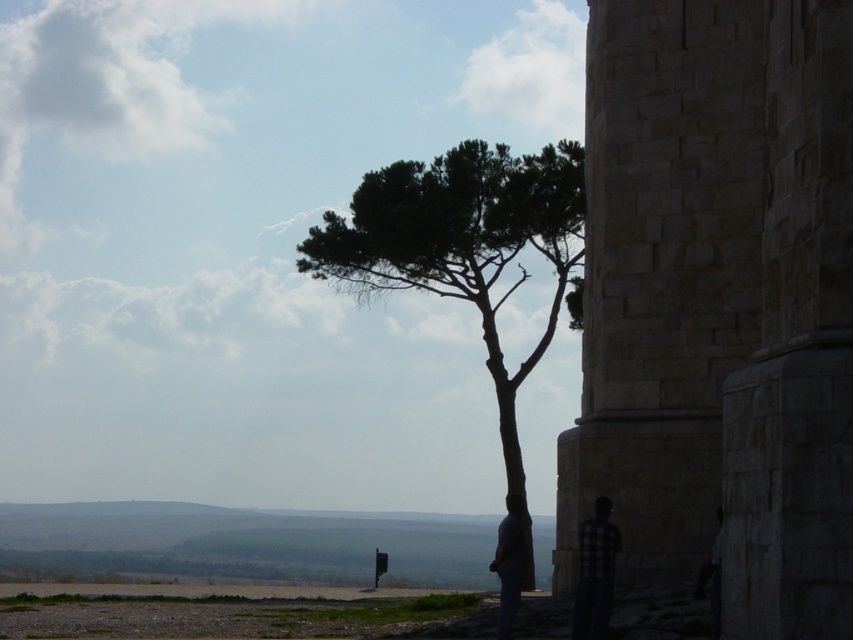
Question: In this image, where is green leafy tree at center located relative to dark blue jeans at lower center?

Choices:
 (A) above
 (B) below

Answer: (A)

Question: Which object appears closest to the camera in this image?

Choices:
 (A) green leafy tree at center
 (B) stone tower at right
 (C) plaid fabric shirt at lower right

Answer: (B)

Question: Considering the real-world distances, which object is closest to the green leafy tree at center?

Choices:
 (A) dark blue jeans at lower center
 (B) stone tower at right
 (C) plaid fabric shirt at lower right

Answer: (A)

Question: Which point appears closest to the camera in this image?

Choices:
 (A) (788, 502)
 (B) (508, 522)
 (C) (378, 284)
 (D) (607, 547)

Answer: (A)

Question: Considering the relative positions of green leafy tree at center and plaid fabric shirt at lower right in the image provided, where is green leafy tree at center located with respect to plaid fabric shirt at lower right?

Choices:
 (A) left
 (B) right

Answer: (A)

Question: Observing the image, what is the correct spatial positioning of stone tower at right in reference to green leafy tree at center?

Choices:
 (A) right
 (B) left

Answer: (A)